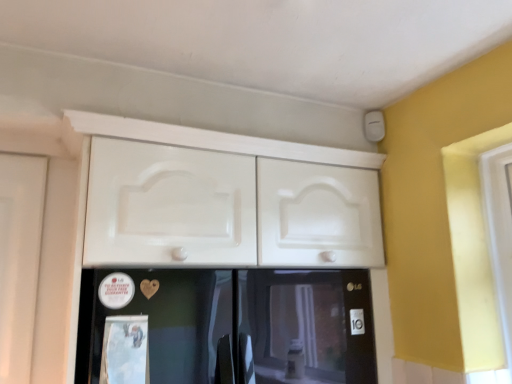
Question: Should I look upward or downward to see white glossy cabinet at upper center?

Choices:
 (A) up
 (B) down

Answer: (B)